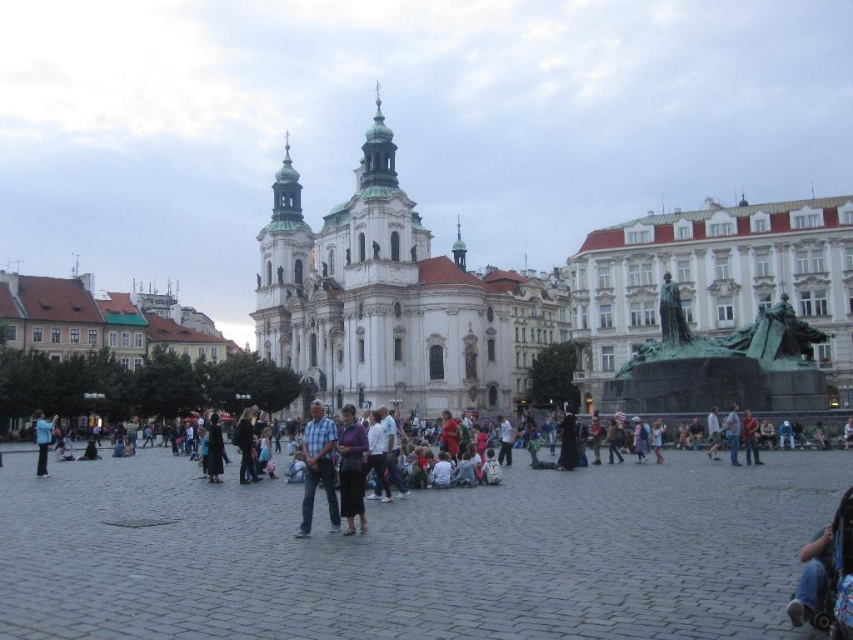
Question: Can you confirm if gray cobblestone square at center is positioned above purple matte dress at center?

Choices:
 (A) no
 (B) yes

Answer: (A)

Question: Can you confirm if bronze statue at center-right is positioned below blue plaid shirt at center?

Choices:
 (A) no
 (B) yes

Answer: (A)

Question: Based on their relative distances, which object is farther from the bronze statue at center-right?

Choices:
 (A) purple matte dress at center
 (B) blue plaid shirt at center
 (C) white stone church at center
 (D) gray cobblestone square at center

Answer: (C)

Question: Does blue plaid shirt at center have a lesser width compared to purple matte dress at center?

Choices:
 (A) no
 (B) yes

Answer: (A)

Question: Among these points, which one is nearest to the camera?

Choices:
 (A) (357, 486)
 (B) (317, 420)
 (C) (368, 134)
 (D) (780, 346)

Answer: (A)

Question: Which point appears closest to the camera in this image?

Choices:
 (A) pos(376,241)
 (B) pos(724,595)

Answer: (B)